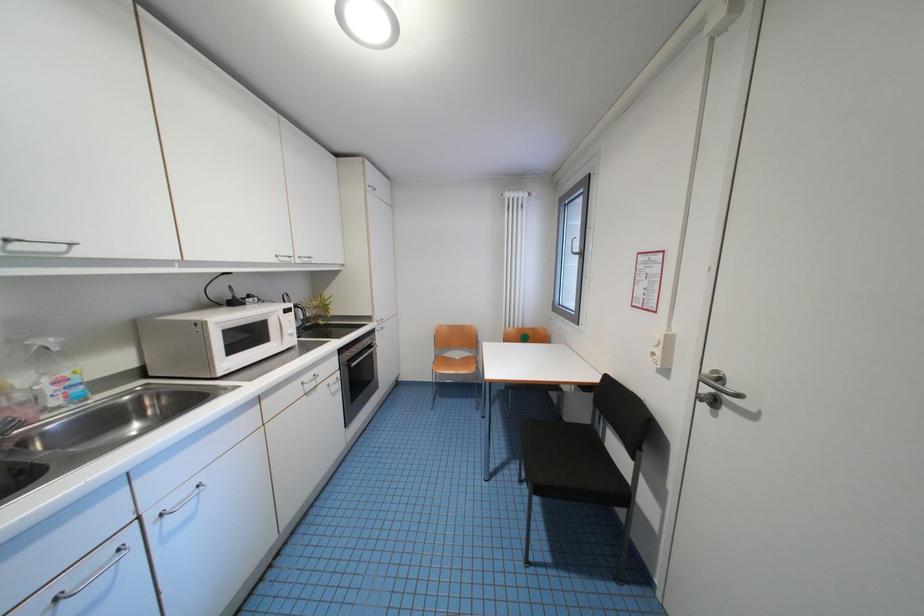
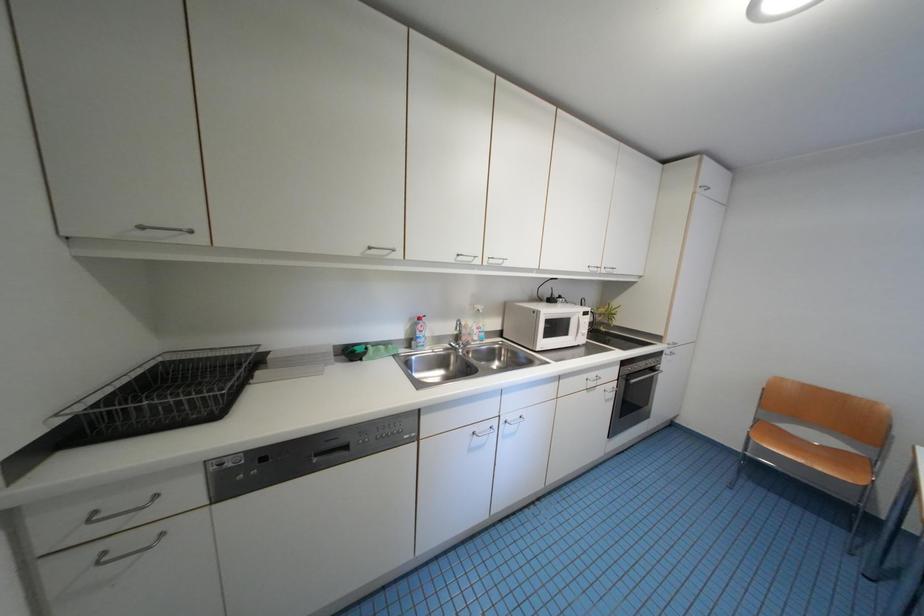
Question: The first image is from the beginning of the video and the second image is from the end. How did the camera likely rotate when shooting the video?

Choices:
 (A) Left
 (B) Right
 (C) Up
 (D) Down

Answer: (A)